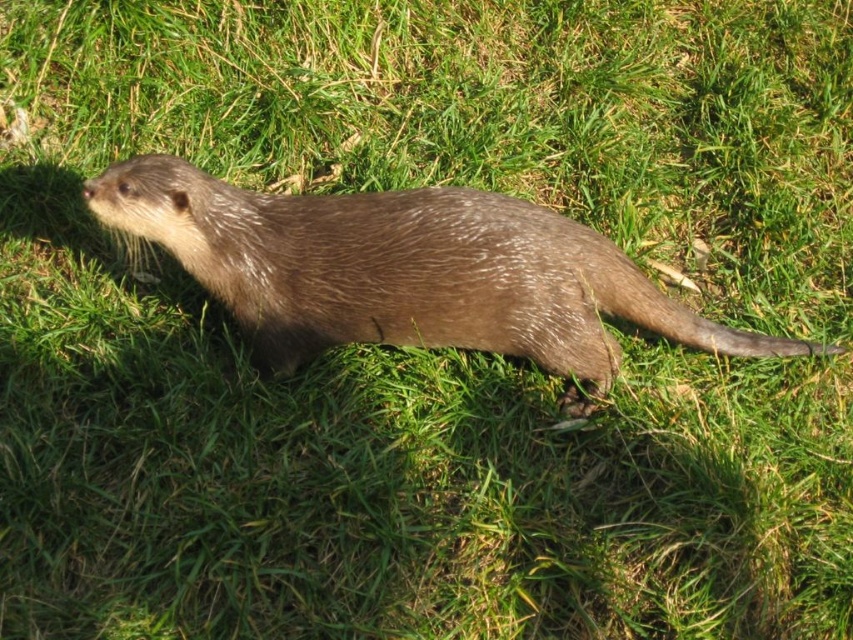
Is brown furry otter at center below brown furry tail at lower right?

No.

Does brown furry otter at center appear on the left side of brown furry tail at lower right?

Yes, brown furry otter at center is to the left of brown furry tail at lower right.

Between point (433, 342) and point (672, 301), which one is positioned in front?

Point (433, 342) is more forward.

Locate an element on the screen. brown furry otter at center is located at coordinates (405, 272).